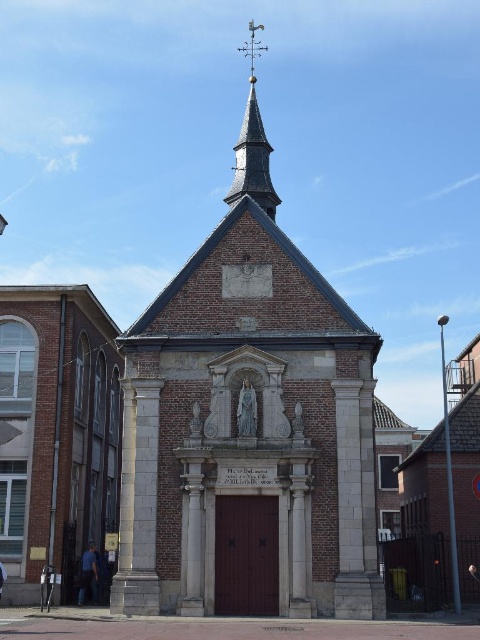
Does white stone tower at center have a lesser width compared to smooth brown spire at upper center?

Incorrect, white stone tower at center's width is not less than smooth brown spire at upper center's.

Between white stone tower at center and smooth brown spire at upper center, which one is positioned lower?

white stone tower at center is below.

This screenshot has width=480, height=640. In order to click on white stone tower at center in this screenshot , I will do `click(249, 426)`.

At what (x,y) coordinates should I click in order to perform the action: click on white stone tower at center. Please return your answer as a coordinate pair (x, y). The width and height of the screenshot is (480, 640). Looking at the image, I should click on (249, 426).